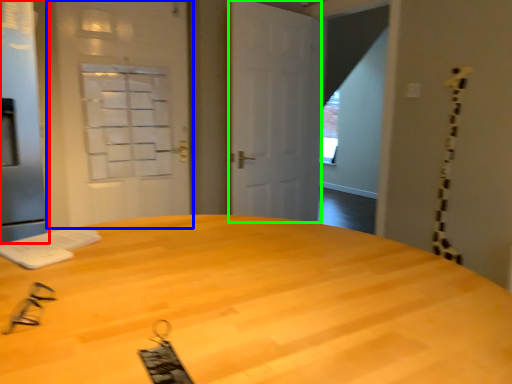
Question: Which object is the farthest from screen door (highlighted by a red box)? Choose among these: screen door (highlighted by a blue box) or door (highlighted by a green box).

Choices:
 (A) screen door
 (B) door

Answer: (B)